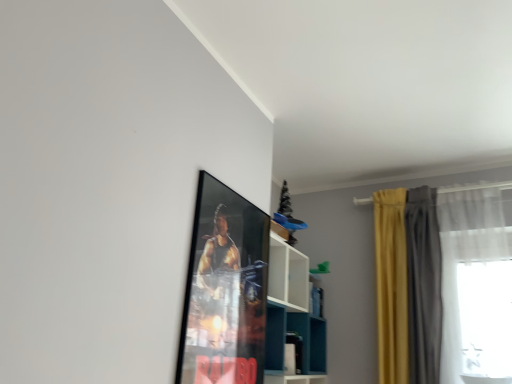
Question: Based on their positions, is yellow fabric curtain at right, positioned as the first curtain in left-to-right order, located to the left or right of white sheer curtain at right, marked as the 3th curtain in a left-to-right arrangement?

Choices:
 (A) left
 (B) right

Answer: (A)

Question: Is yellow fabric curtain at right, the third curtain viewed from the right, wider or thinner than white sheer curtain at right, marked as the 3th curtain in a left-to-right arrangement?

Choices:
 (A) wide
 (B) thin

Answer: (B)

Question: Which object is positioned farthest from the metallic poster at upper center?

Choices:
 (A) yellow fabric curtain at right, the third curtain viewed from the right
 (B) white sheer curtain at right, marked as the 3th curtain in a left-to-right arrangement
 (C) yellow velvet curtains at right, which is the second curtain from right to left
 (D) white glossy shelf at upper center

Answer: (B)

Question: Which is farther from the white glossy shelf at upper center?

Choices:
 (A) yellow velvet curtains at right, which is counted as the second curtain, starting from the left
 (B) yellow fabric curtain at right, the third curtain viewed from the right
 (C) white sheer curtain at right, marked as the 3th curtain in a left-to-right arrangement
 (D) metallic poster at upper center

Answer: (A)